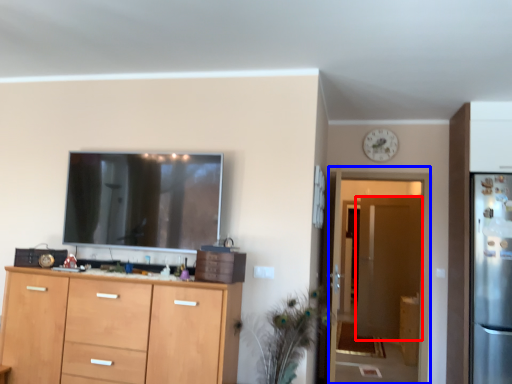
Question: Which object appears farthest to the camera in this image, door (highlighted by a red box) or glass door (highlighted by a blue box)?

Choices:
 (A) door
 (B) glass door

Answer: (A)